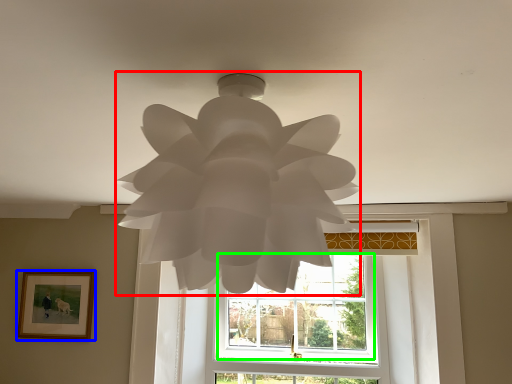
Question: Estimate the real-world distances between objects in this image. Which object is closer to lamp (highlighted by a red box), picture frame (highlighted by a blue box) or window (highlighted by a green box)?

Choices:
 (A) picture frame
 (B) window

Answer: (A)